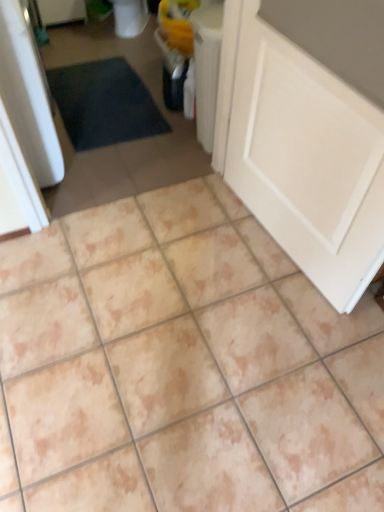
I want to click on vacant space positioned to the left of white matte door at lower right, so click(177, 243).